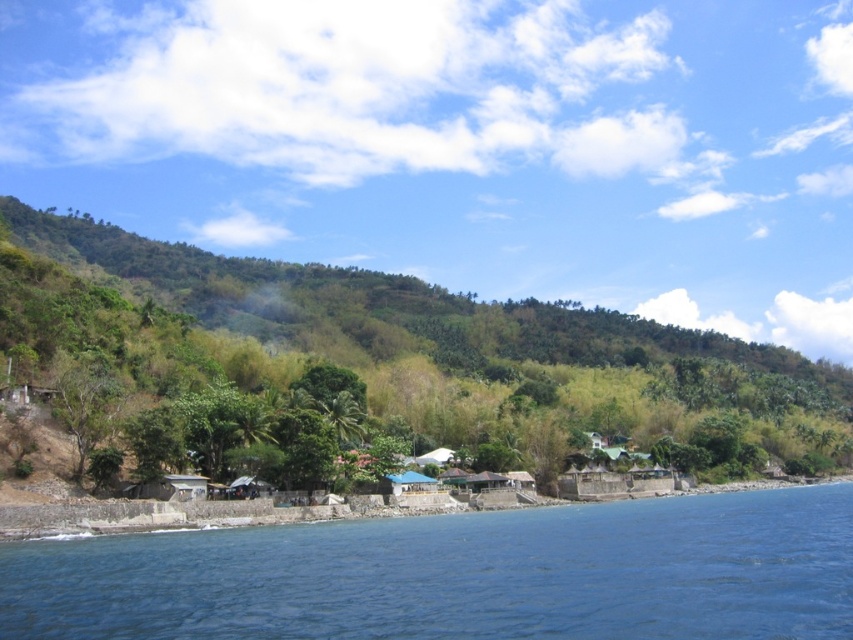
Between point (732, 522) and point (259, 289), which one is positioned behind?

Positioned behind is point (259, 289).

Is blue water at lower left above green leafy hillside at center?

Incorrect, blue water at lower left is not positioned above green leafy hillside at center.

At what (x,y) coordinates should I click in order to perform the action: click on blue water at lower left. Please return your answer as a coordinate pair (x, y). This screenshot has height=640, width=853. Looking at the image, I should click on (459, 576).